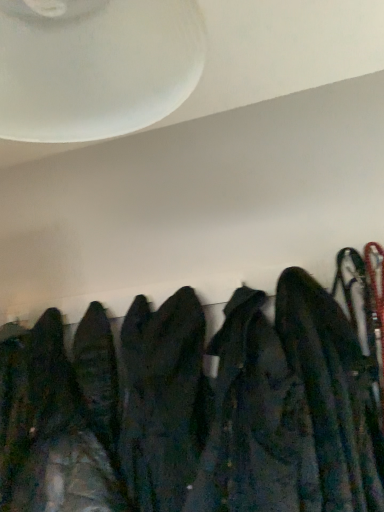
Question: Considering the positions of white frosted glass fan at upper center and dark blue fabric jacket at right in the image, is white frosted glass fan at upper center bigger or smaller than dark blue fabric jacket at right?

Choices:
 (A) small
 (B) big

Answer: (A)

Question: Is white frosted glass fan at upper center wider or thinner than dark blue fabric jacket at right?

Choices:
 (A) thin
 (B) wide

Answer: (A)

Question: Which is correct: white frosted glass fan at upper center is inside dark blue fabric jacket at right, or outside of it?

Choices:
 (A) outside
 (B) inside

Answer: (A)

Question: In terms of size, does dark blue fabric jacket at right appear bigger or smaller than white frosted glass fan at upper center?

Choices:
 (A) big
 (B) small

Answer: (A)

Question: Choose the correct answer: Is dark blue fabric jacket at right inside white frosted glass fan at upper center or outside it?

Choices:
 (A) outside
 (B) inside

Answer: (A)

Question: Considering the positions of dark blue fabric jacket at right and white frosted glass fan at upper center in the image, is dark blue fabric jacket at right wider or thinner than white frosted glass fan at upper center?

Choices:
 (A) wide
 (B) thin

Answer: (A)

Question: From their relative heights in the image, would you say dark blue fabric jacket at right is taller or shorter than white frosted glass fan at upper center?

Choices:
 (A) short
 (B) tall

Answer: (B)